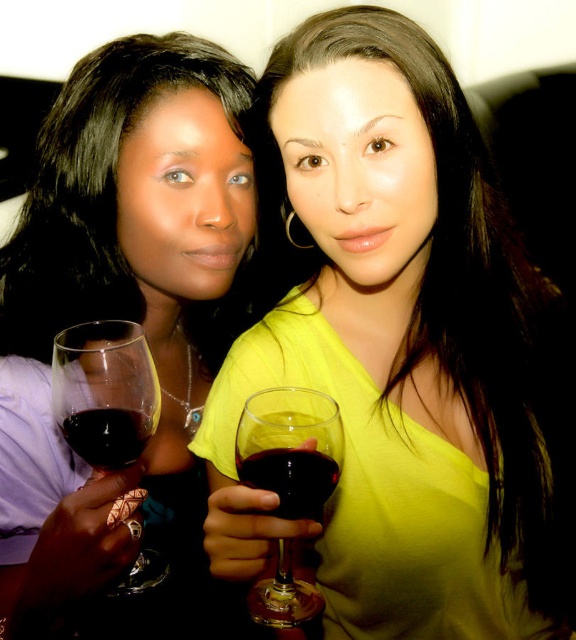
Question: Can you confirm if transparent glass at left is positioned above translucent glass wine glass at center?

Choices:
 (A) no
 (B) yes

Answer: (B)

Question: Is the position of matte black wine glass at left less distant than that of dark red liquid at center?

Choices:
 (A) yes
 (B) no

Answer: (A)

Question: Which is farther from the translucent glass wine glass at center?

Choices:
 (A) dark red liquid at center
 (B) matte black wine glass at left
 (C) ruby glass at center
 (D) matte glass wine at center

Answer: (B)

Question: Is matte glass wine at center above transparent glass at left?

Choices:
 (A) yes
 (B) no

Answer: (A)

Question: Which point is closer to the camera?

Choices:
 (A) tap(456, 168)
 (B) tap(104, 435)
 (C) tap(73, 426)
 (D) tap(248, 442)

Answer: (D)

Question: Which point appears closest to the camera in this image?

Choices:
 (A) (111, 458)
 (B) (249, 428)
 (C) (328, 481)

Answer: (C)